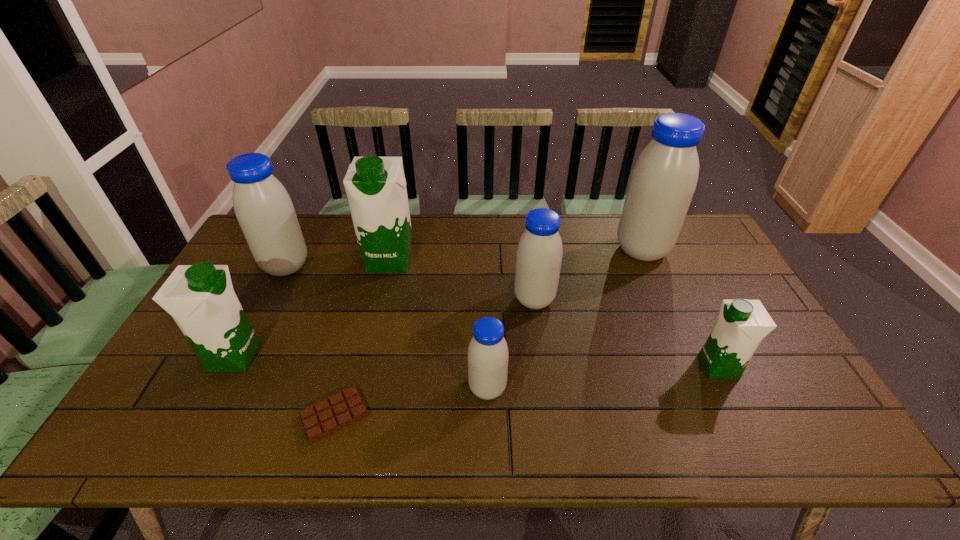
Find the location of a particular element. This screenshot has height=540, width=960. free space located on the back of the fourth soya milk from left to right is located at coordinates (486, 289).

Image resolution: width=960 pixels, height=540 pixels. In order to click on vacant space situated 0.260m on the back of the candy bar in this screenshot , I will do `click(363, 312)`.

Locate an element on the screen. The width and height of the screenshot is (960, 540). object that is at the near edge is located at coordinates (328, 416).

Find the location of `object situated at the far left corner`. object situated at the far left corner is located at coordinates (263, 207).

Locate an element on the screen. Image resolution: width=960 pixels, height=540 pixels. object that is at the far right corner is located at coordinates (663, 181).

Locate an element on the screen. The height and width of the screenshot is (540, 960). free space at the far edge of the desktop is located at coordinates (597, 217).

The width and height of the screenshot is (960, 540). I want to click on vacant space at the near edge, so click(444, 424).

This screenshot has width=960, height=540. Identify the location of free space at the left edge of the desktop. (149, 396).

In the image, there is a desktop. Where is `vacant area at the right edge`? The width and height of the screenshot is (960, 540). vacant area at the right edge is located at coordinates (799, 402).

I want to click on free space between the fourth nearest soya milk and the leftmost green soya milk, so click(384, 328).